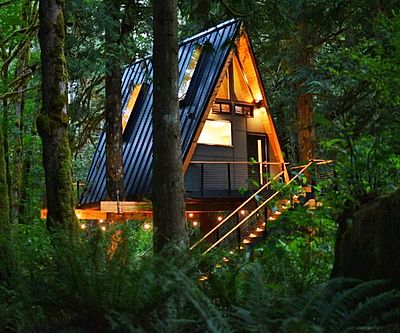
Locate an element on the screen. The height and width of the screenshot is (333, 400). door is located at coordinates (255, 154).